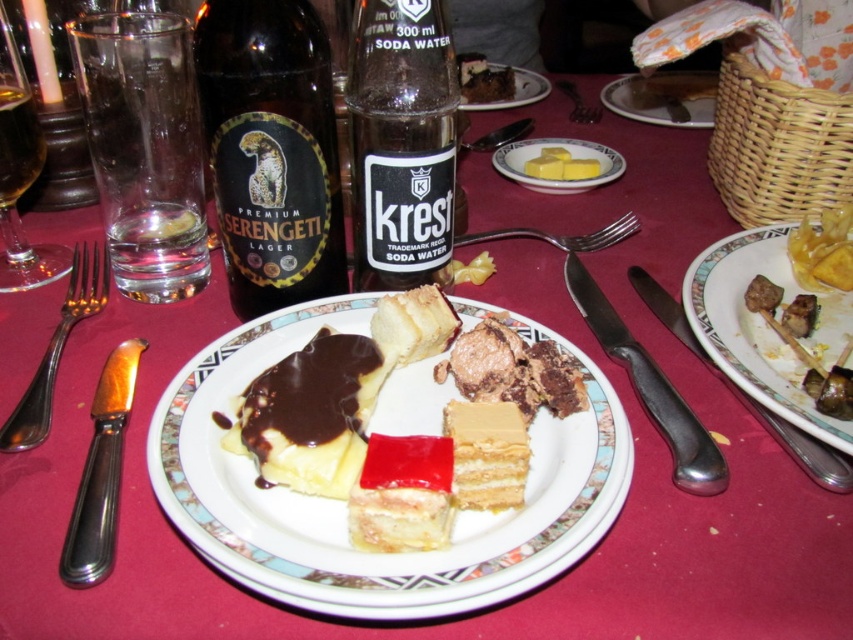
Consider the image. You are a guest at the table and want to reach for both the matte ceramic plate at lower right and the yellow matte butter at upper right. Considering their positions, which one is closer to your hand if you are sitting at the center of the table?

The matte ceramic plate at lower right is closer to your hand than the yellow matte butter at upper right since it is only 9.47 inches away.

You are a guest at the table and want to reach for the dark brown glass bottle at upper left. Based on the coordinates given, can you estimate its location relative to the desserts on the table?

The dark brown glass bottle at upper left is positioned at coordinates point (271, 150), which places it near the upper left corner of the table, likely above and to the left of the desserts located in the foreground.

You are a guest at a dinner party and want to reach for the matte ceramic plate at lower right. If the table is represented as a coordinate system where the bottom left corner is the origin point, can you estimate the plate location based on the coordinates provided?

The matte ceramic plate at lower right is located at coordinates point (x=753, y=326), so it is positioned near the lower right side of the table.